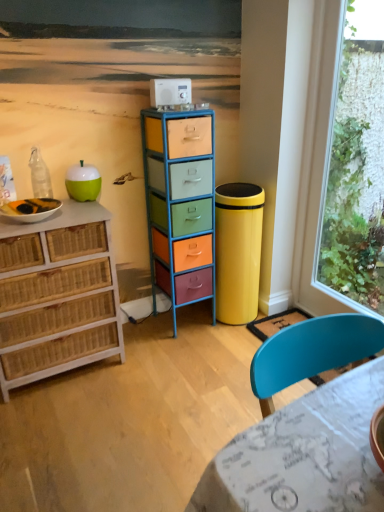
What are the coordinates of `free space to the right of woven wood chest of drawers at left, placed as the 2th chest of drawers when sorted from right to left` in the screenshot? It's located at (148, 375).